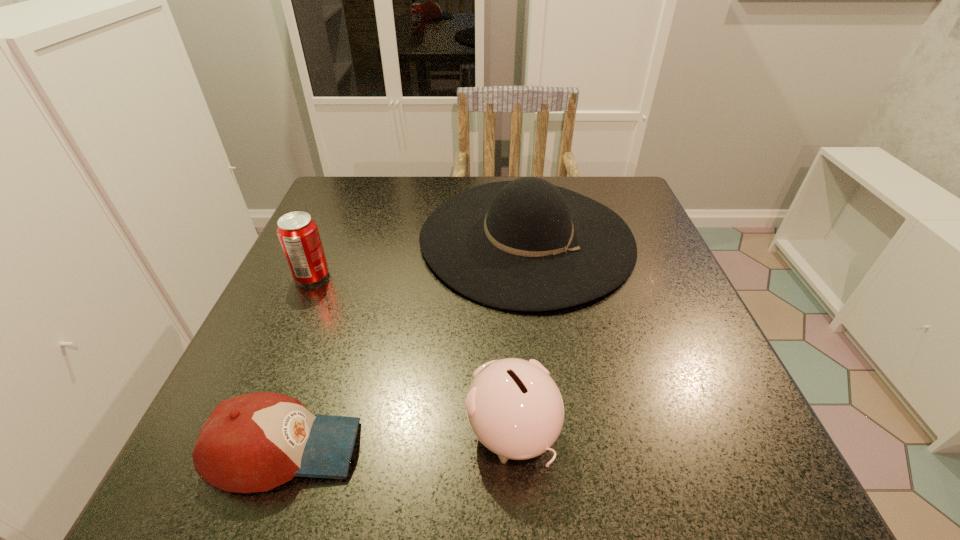
This screenshot has height=540, width=960. Find the location of `blank space at the far right corner of the desktop`. blank space at the far right corner of the desktop is located at coordinates (618, 200).

At what (x,y) coordinates should I click in order to perform the action: click on vacant space at the near right corner of the desktop. Please return your answer as a coordinate pair (x, y). The width and height of the screenshot is (960, 540). Looking at the image, I should click on point(748,441).

In order to click on free spot between the shortest object and the soda in this screenshot , I will do [x=299, y=362].

Find the location of a particular element. The image size is (960, 540). empty space that is in between the piggy bank and the baseball cap is located at coordinates (398, 441).

This screenshot has width=960, height=540. Identify the location of free space between the piggy bank and the soda. (412, 355).

The width and height of the screenshot is (960, 540). Find the location of `vacant point located between the soda and the shortest object`. vacant point located between the soda and the shortest object is located at coordinates (299, 362).

Where is `free area in between the soda and the sombrero`? The height and width of the screenshot is (540, 960). free area in between the soda and the sombrero is located at coordinates (420, 257).

Where is `free area in between the soda and the baseball cap`? The image size is (960, 540). free area in between the soda and the baseball cap is located at coordinates (299, 362).

Identify the location of free space between the soda and the sombrero. (420, 257).

Locate an element on the screen. Image resolution: width=960 pixels, height=540 pixels. free space between the soda and the piggy bank is located at coordinates (412, 355).